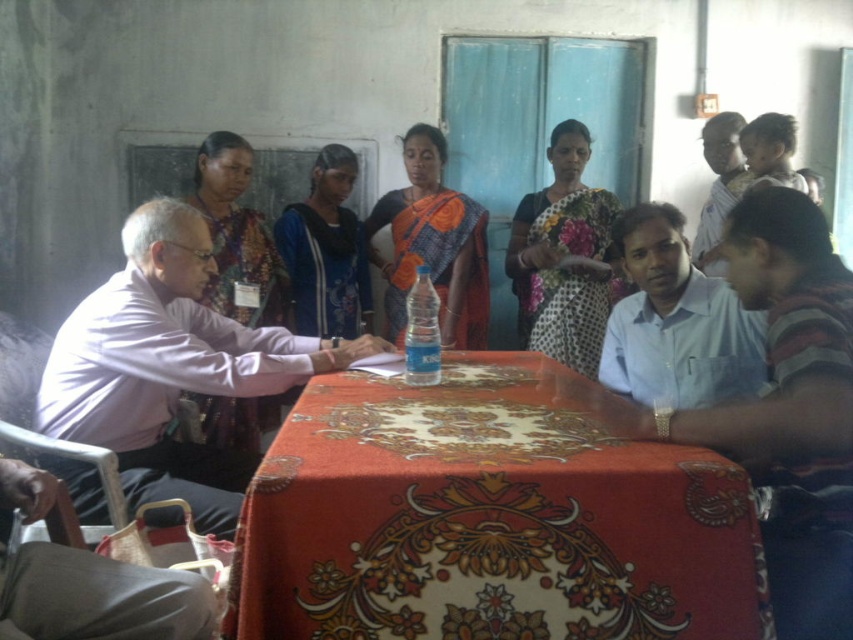
Between purple shirt at left and blue sari at center, which one has less height?

purple shirt at left is shorter.

Does purple shirt at left appear on the left side of blue sari at center?

Indeed, purple shirt at left is positioned on the left side of blue sari at center.

Is point (195, 262) more distant than point (451, 282)?

No, (195, 262) is closer to viewer.

Locate an element on the screen. purple shirt at left is located at coordinates (170, 365).

Is point (190, 497) positioned after point (749, 152)?

No.

Does purple shirt at left have a greater width compared to smooth skin baby at upper right?

Yes, purple shirt at left is wider than smooth skin baby at upper right.

Identify the location of purple shirt at left. (170, 365).

Is point (674, 445) positioned before point (793, 128)?

That is True.

Who is positioned more to the right, floral-patterned fabric at center or smooth skin baby at upper right?

smooth skin baby at upper right is more to the right.

Which is behind, point (485, 460) or point (769, 129)?

Positioned behind is point (769, 129).

Where is `floral-patterned fabric at center`? floral-patterned fabric at center is located at coordinates (486, 520).